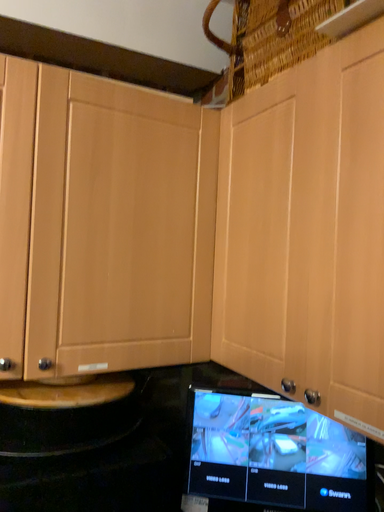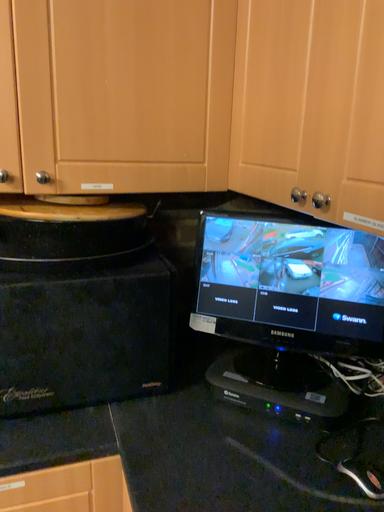
Question: Which way did the camera rotate in the video?

Choices:
 (A) rotated left
 (B) rotated right

Answer: (A)